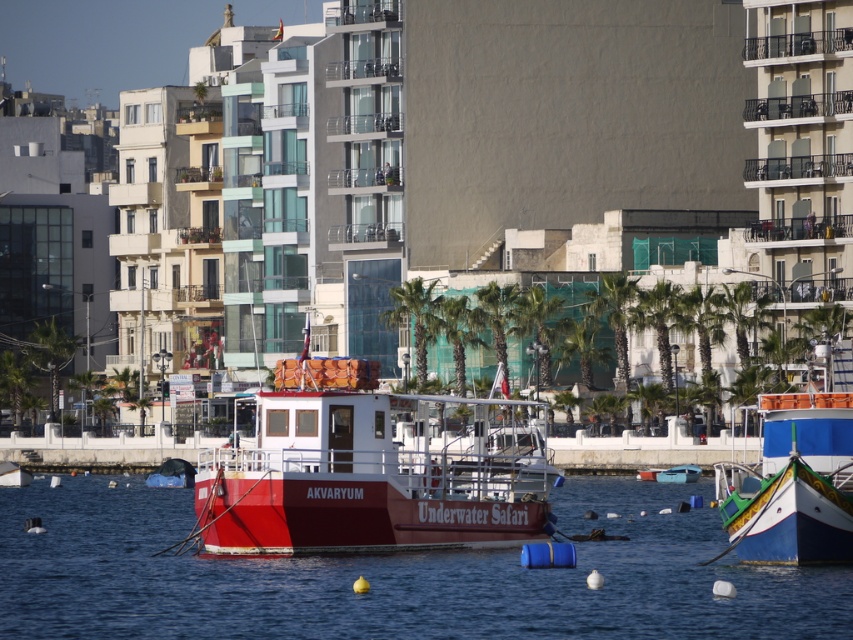
Question: Does red matte boat at center appear on the left side of blue painted wooden boat at lower right?

Choices:
 (A) yes
 (B) no

Answer: (A)

Question: Which object is closer to the camera taking this photo?

Choices:
 (A) red matte boat at center
 (B) blue painted wooden boat at lower right

Answer: (B)

Question: Considering the relative positions of red matte boat at center and blue painted wooden boat at lower right in the image provided, where is red matte boat at center located with respect to blue painted wooden boat at lower right?

Choices:
 (A) right
 (B) left

Answer: (B)

Question: Which point is farther from the camera taking this photo?

Choices:
 (A) (821, 461)
 (B) (548, 618)
 (C) (241, 554)

Answer: (C)

Question: Is red matte boat at center in front of blue painted wooden boat at lower right?

Choices:
 (A) no
 (B) yes

Answer: (A)

Question: Among these objects, which one is farthest from the camera?

Choices:
 (A) transparent blue water at center
 (B) red matte boat at center
 (C) blue painted wooden boat at lower right

Answer: (B)